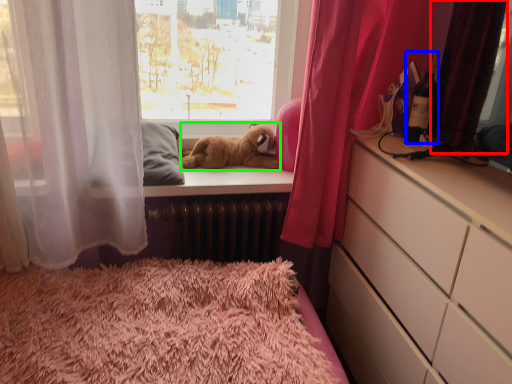
Question: Based on their relative distances, which object is nearer to curtain (highlighted by a red box)? Choose from bottle (highlighted by a blue box) and animal (highlighted by a green box).

Choices:
 (A) bottle
 (B) animal

Answer: (A)